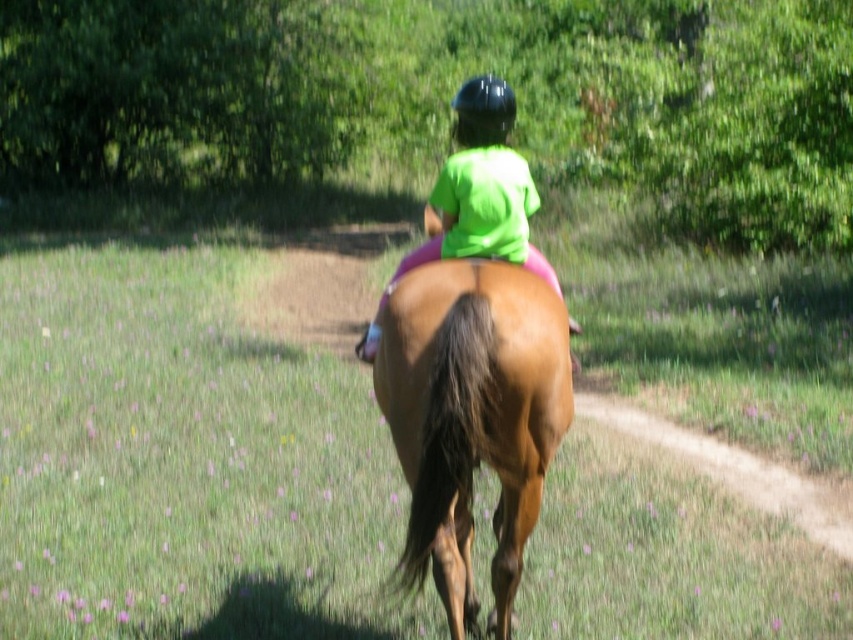
Question: Among these points, which one is farthest from the camera?

Choices:
 (A) (488, 83)
 (B) (445, 216)
 (C) (488, 380)
 (D) (712, 618)

Answer: (D)

Question: Which point is closer to the camera taking this photo?

Choices:
 (A) (474, 99)
 (B) (1, 584)
 (C) (430, 396)

Answer: (C)

Question: Based on their relative distances, which object is nearer to the brown glossy horse at center?

Choices:
 (A) green grassy field at center
 (B) neon green t-shirt at center

Answer: (B)

Question: Is green grassy field at center behind neon green t-shirt at center?

Choices:
 (A) yes
 (B) no

Answer: (B)

Question: Is green grassy field at center to the left of neon green t-shirt at center from the viewer's perspective?

Choices:
 (A) yes
 (B) no

Answer: (A)

Question: Is brown glossy horse at center to the left of neon green t-shirt at center from the viewer's perspective?

Choices:
 (A) yes
 (B) no

Answer: (B)